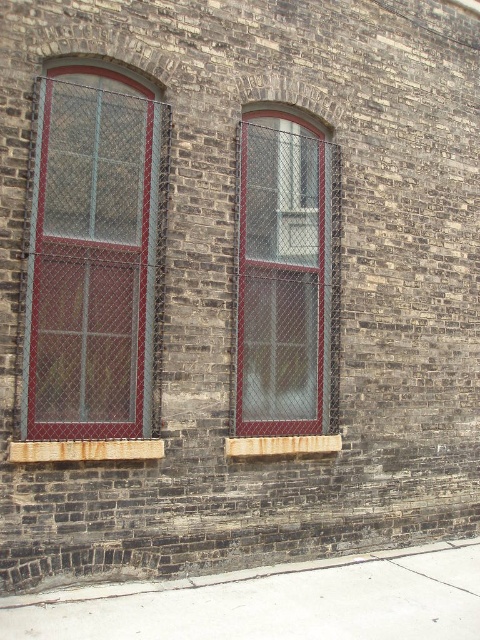
Which is in front, point (146, 598) or point (119, 452)?

Point (146, 598) is more forward.

Which is behind, point (82, 588) or point (34, 442)?

The point (82, 588) is behind.

Who is more forward, (383, 552) or (41, 442)?

Point (41, 442) is more forward.

At what (x,y) coordinates should I click in order to perform the action: click on gray concrete pavement at lower center. Please return your answer as a coordinate pair (x, y). This screenshot has width=480, height=640. Looking at the image, I should click on (274, 602).

Is gray concrete pavement at lower center closer to camera compared to wooden at lower center?

Yes, it is in front of wooden at lower center.

Does point (450, 570) lie behind point (308, 451)?

No, it is in front of (308, 451).

Is point (396, 637) positioned before point (271, 449)?

That is True.

This screenshot has width=480, height=640. I want to click on gray concrete pavement at lower center, so click(274, 602).

Does matte glass window at center have a smaller size compared to wooden at lower left?

No, matte glass window at center is not smaller than wooden at lower left.

Where is `matte glass window at center`? matte glass window at center is located at coordinates (282, 275).

Image resolution: width=480 pixels, height=640 pixels. I want to click on matte glass window at center, so click(x=282, y=275).